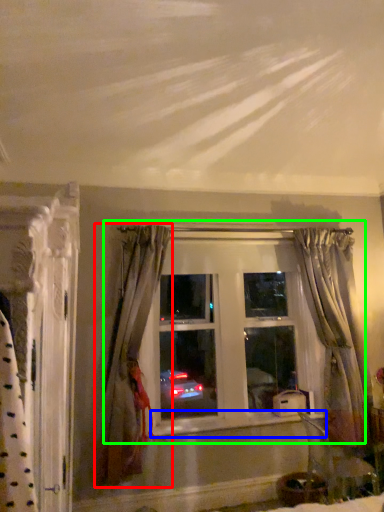
Question: Estimate the real-world distances between objects in this image. Which object is closer to curtain (highlighted by a red box), window sill (highlighted by a blue box) or window (highlighted by a green box)?

Choices:
 (A) window sill
 (B) window

Answer: (B)